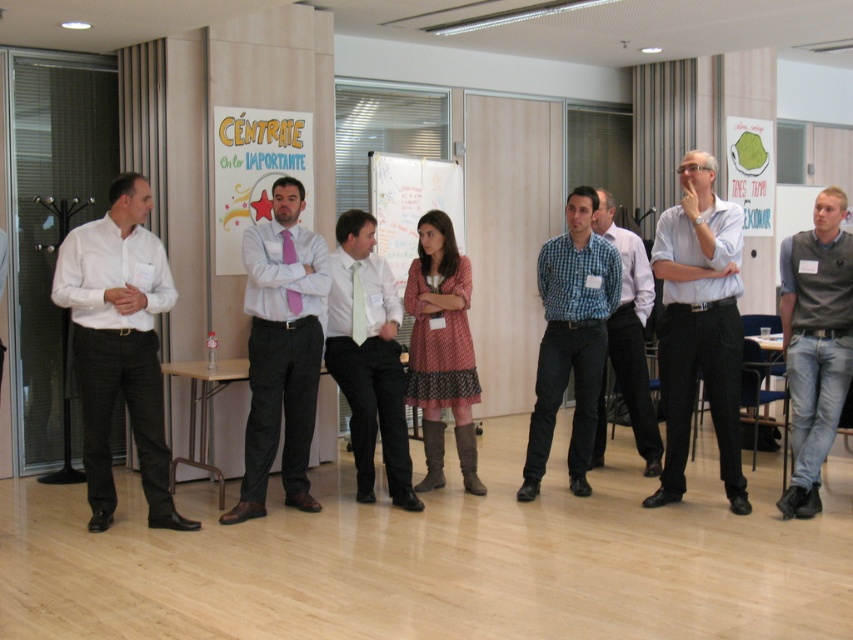
Does pink fabric shirt at center appear over dotted fabric dress at center?

Correct, pink fabric shirt at center is located above dotted fabric dress at center.

Between pink fabric shirt at center and dotted fabric dress at center, which one is positioned lower?

dotted fabric dress at center is lower down.

Who is more forward, (254, 307) or (434, 417)?

Point (254, 307) is more forward.

Where is `pink fabric shirt at center`? The image size is (853, 640). pink fabric shirt at center is located at coordinates (281, 349).

In the scene shown: Is light blue shirt at center bigger than light green silk tie at center?

Correct, light blue shirt at center is larger in size than light green silk tie at center.

Who is more forward, (668,300) or (364,314)?

Point (668,300) is more forward.

Who is more distant from viewer, (709,344) or (402,404)?

The point (402,404) is behind.

Identify the location of light blue shirt at center. The height and width of the screenshot is (640, 853). (699, 324).

Does pink fabric shirt at center appear on the left side of checkered fabric shirt at center?

Indeed, pink fabric shirt at center is positioned on the left side of checkered fabric shirt at center.

Does point (299, 461) come in front of point (573, 296)?

Yes, point (299, 461) is in front of point (573, 296).

This screenshot has height=640, width=853. What are the coordinates of `pink fabric shirt at center` in the screenshot? It's located at (281, 349).